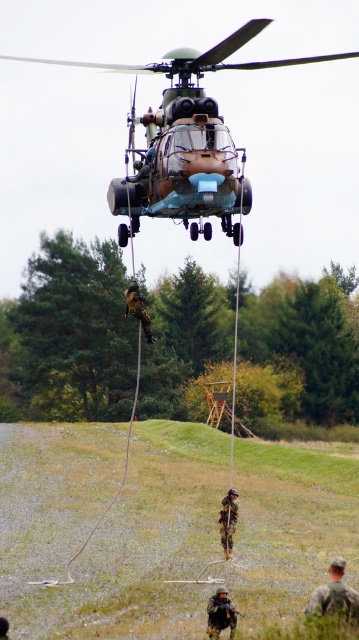
Question: Can you confirm if camouflage fabric uniform at center is positioned above camouflage fabric soldier at center?

Choices:
 (A) yes
 (B) no

Answer: (B)

Question: Can you confirm if camouflage fabric helicopter at upper center is smaller than camouflage fabric helmet at center?

Choices:
 (A) yes
 (B) no

Answer: (B)

Question: Which object is the closest to the camouflage fabric helicopter at upper center?

Choices:
 (A) camouflage fabric uniform at center
 (B) camouflage uniform at lower right

Answer: (A)

Question: Is camouflage fabric helmet at center wider than camouflage fabric soldier at center?

Choices:
 (A) yes
 (B) no

Answer: (B)

Question: Among these objects, which one is farthest from the camera?

Choices:
 (A) camouflage fabric uniform at center
 (B) camouflage fabric helmet at center
 (C) camouflage uniform at lower right

Answer: (A)

Question: Estimate the real-world distances between objects in this image. Which object is farther from the camouflage fabric soldier at center?

Choices:
 (A) camouflage fabric helicopter at upper center
 (B) camouflage fabric helmet at center

Answer: (A)